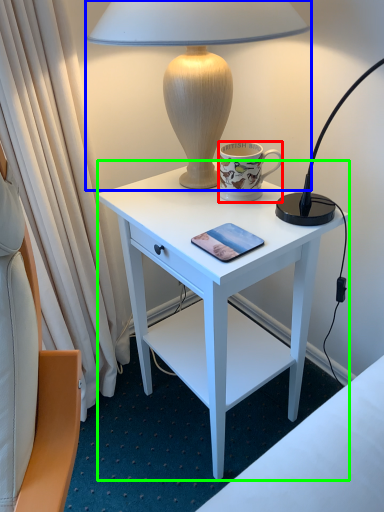
Question: Which object is positioned closest to coffee cup (highlighted by a red box)? Select from lamp (highlighted by a blue box) and desk (highlighted by a green box).

Choices:
 (A) lamp
 (B) desk

Answer: (A)